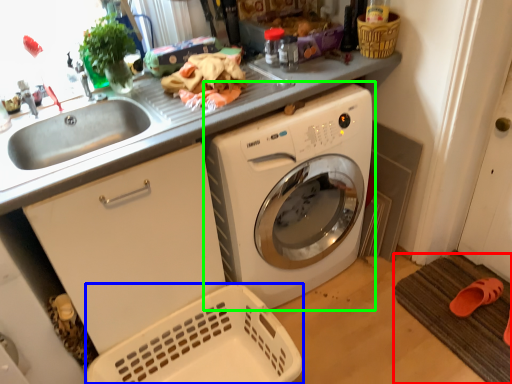
Question: Considering the real-world distances, which object is farthest from bath mat (highlighted by a red box)? basket (highlighted by a blue box) or washing machine (highlighted by a green box)?

Choices:
 (A) basket
 (B) washing machine

Answer: (A)